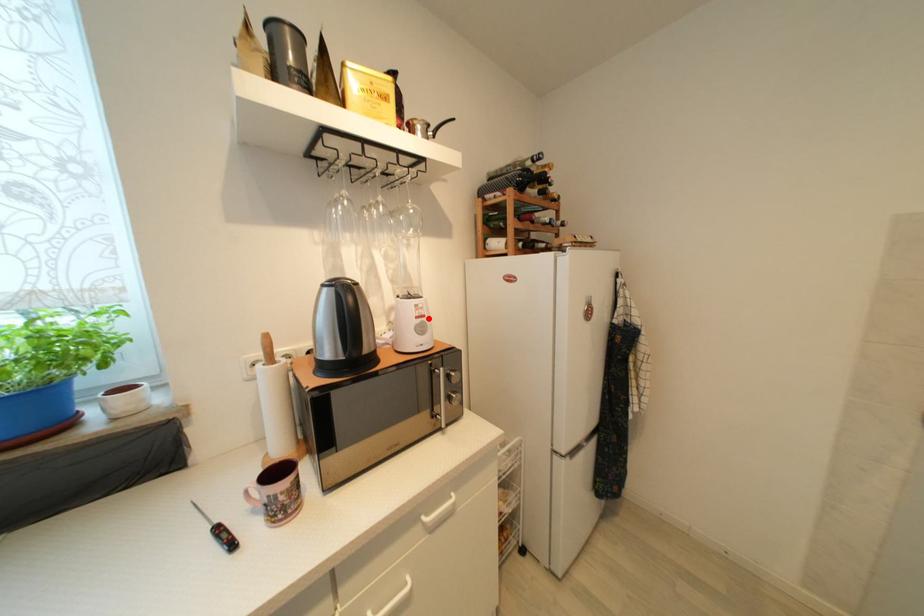
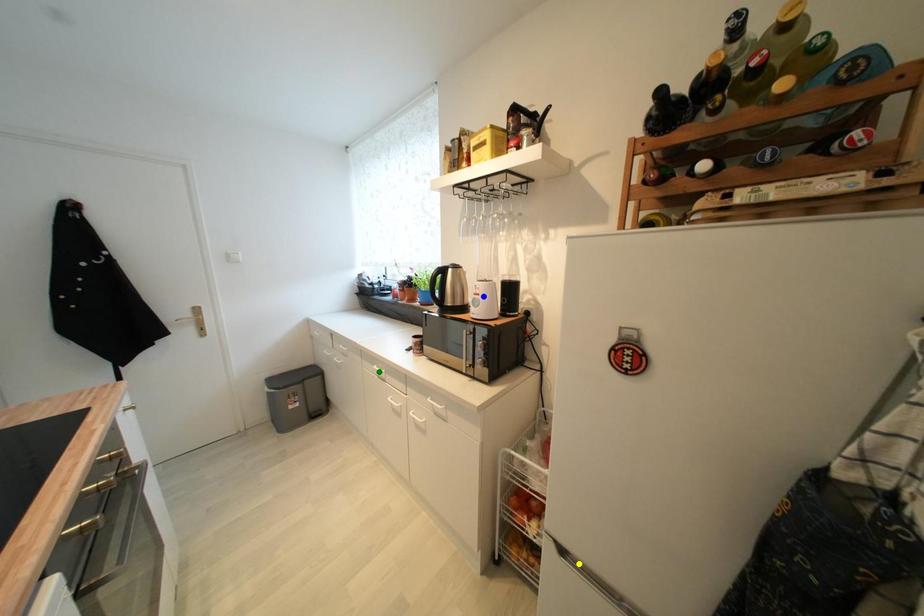
Question: I am providing you with two images of the same scene from different viewpoints. A red point is marked on the first image. You are given multiple points on the second image. In image 2, which mark is for the same physical point as the one in image 1?

Choices:
 (A) yellow point
 (B) green point
 (C) blue point

Answer: (C)